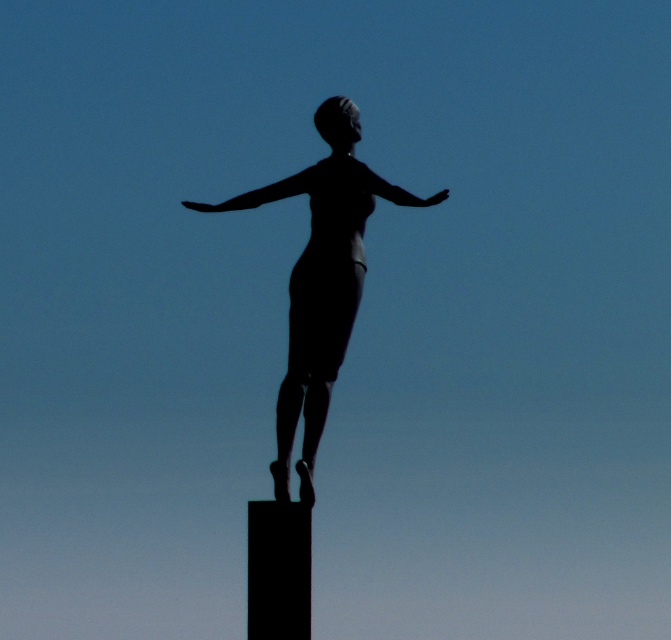
Question: Is silhouette statue at center thinner than black matte pole at center?

Choices:
 (A) no
 (B) yes

Answer: (A)

Question: Which of the following is the closest to the observer?

Choices:
 (A) (399, 204)
 (B) (221, 211)
 (C) (325, 266)
 (D) (266, 612)

Answer: (D)

Question: Can you confirm if silhouette statue at center is positioned below black matte pole at center?

Choices:
 (A) no
 (B) yes

Answer: (A)

Question: Which point is closer to the camera?

Choices:
 (A) silvery metallic arm at center
 (B) black matte arm at center

Answer: (A)

Question: Can you confirm if black matte pole at center is thinner than silvery metallic arm at center?

Choices:
 (A) yes
 (B) no

Answer: (A)

Question: Which object is closer to the camera taking this photo?

Choices:
 (A) silvery metallic arm at center
 (B) black matte pole at center
 (C) silhouette statue at center
 (D) black matte arm at center

Answer: (B)